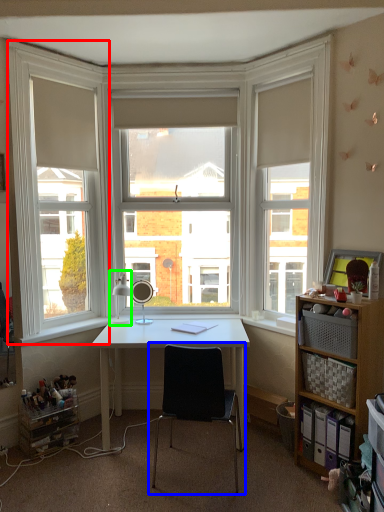
Question: Which is nearer to the window frame (highlighted by a red box)? chair (highlighted by a blue box) or table lamp (highlighted by a green box).

Choices:
 (A) chair
 (B) table lamp

Answer: (B)